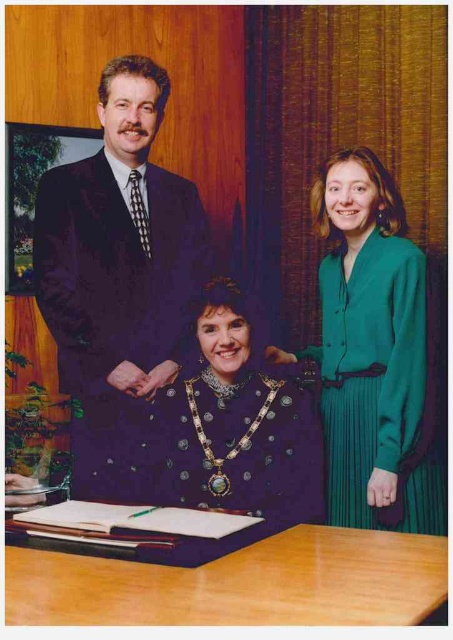
What is located at the coordinates point (374, 355)?

The green silk blouse at right is located at point (374, 355).

You are a photographer setting up for a group photo. You need to ensure that all subjects are visible. Given the purple velvet dress at center and the green silk blouse at right, which one might require more space to accommodate in the frame?

The green silk blouse at right requires more space because it occupies more area than the purple velvet dress at center.

You are a photographer setting up for a group photo. You need to ensure that the dark suit at center is visible above the light brown wooden table at lower center. Based on the scene description, is this already the case?

Yes, the dark suit at center is already positioned above the light brown wooden table at lower center as described in the scene.